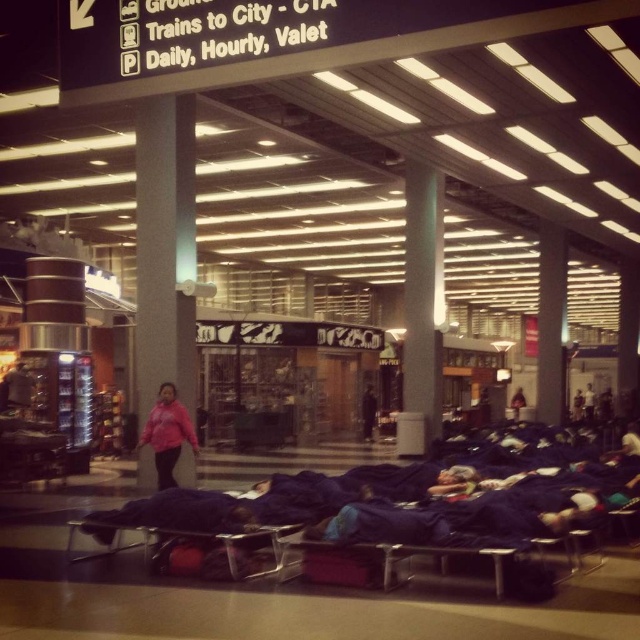
Based on the photo, is pink fleece jacket at center to the left of dark blue fabric sleeping bag at center from the viewer's perspective?

Yes, pink fleece jacket at center is to the left of dark blue fabric sleeping bag at center.

Does pink fleece jacket at center lie behind dark blue fabric sleeping bag at center?

No, pink fleece jacket at center is in front of dark blue fabric sleeping bag at center.

Which is in front, point (180, 436) or point (518, 388)?

Point (180, 436) is more forward.

Identify the location of pink fleece jacket at center. The image size is (640, 640). (168, 433).

Is dark blue fabric at center below dark blue fabric sleeping bag at center?

Actually, dark blue fabric at center is above dark blue fabric sleeping bag at center.

I want to click on dark blue fabric at center, so click(x=369, y=412).

The height and width of the screenshot is (640, 640). What are the coordinates of `dark blue fabric at center` in the screenshot? It's located at (369, 412).

Can you confirm if pink fleece jacket at center is smaller than dark blue fabric at center?

No.

Is pink fleece jacket at center wider than dark blue fabric at center?

Indeed, pink fleece jacket at center has a greater width compared to dark blue fabric at center.

Is point (168, 392) farther from viewer compared to point (372, 406)?

That is False.

This screenshot has width=640, height=640. Find the location of `pink fleece jacket at center`. pink fleece jacket at center is located at coordinates (168, 433).